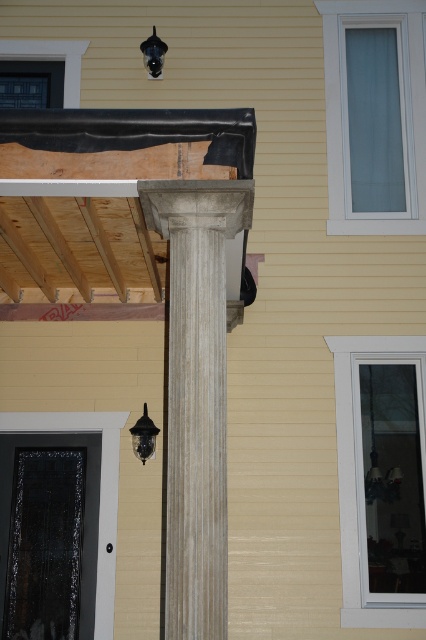
You are standing outside the house looking at the construction site. You see a point marked at coordinates (143, 436). What object is located at this point?

The point at coordinates (143, 436) corresponds to the matte black lamp at lower left.